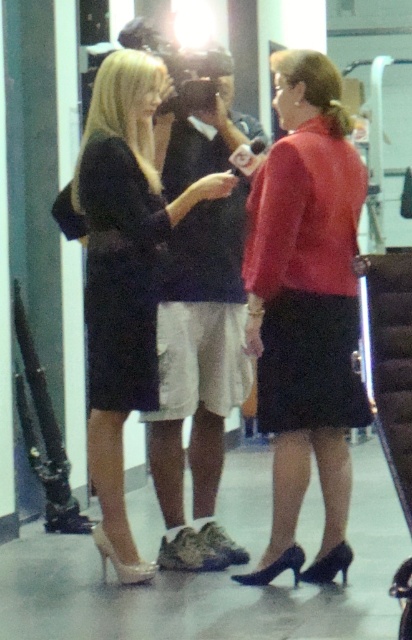
You are a photographer setting up for a group photo. You need to position the matte red blouse at center and the matte black dress at center in a way that they are both visible. Based on their current positions, which one should you move to the left to ensure both are visible in the frame?

You should move the matte black dress at center to the left because the matte red blouse at center is currently to the right of the matte black dress at center, so shifting the dress left would create space for both to be visible.

You are a photographer in an indoor event space. You need to capture a clear photo of both the matte red blouse at center and the matte black dress at center. Since the two are partially overlapping, which one should you adjust to be in front to ensure both are visible?

The matte red blouse at center is shorter than the matte black dress at center. To ensure both are visible, you should position the matte red blouse at center in front of the matte black dress at center so that its shorter length does not get obscured by the longer dress.

You are a photographer setting up for a group photo in the scene described. You need to position the matte red blouse at center and the matte black dress at center so that both are fully visible. Which of the two should you adjust to be narrower to ensure they don not overlap?

The matte red blouse at center has a lesser width compared to the matte black dress at center, so you should adjust the matte black dress at center to be narrower to ensure they do not overlap.